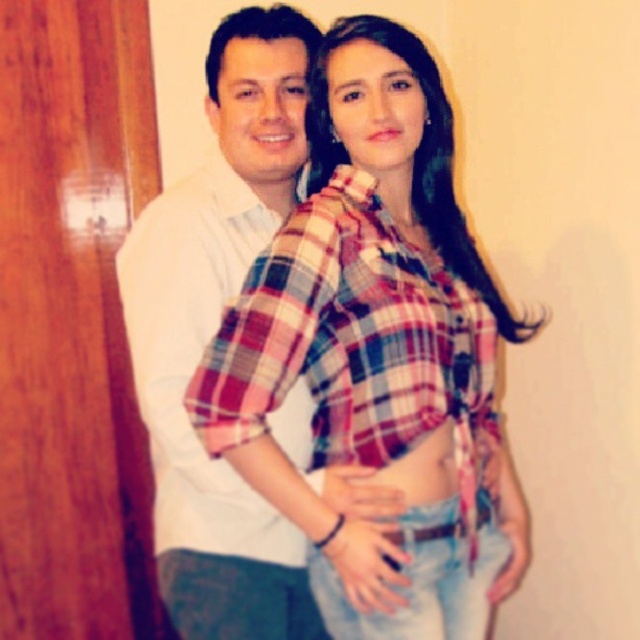
You are a photographer setting up for a portrait. You need to ensure that the plaid cotton shirt at center and smooth fabric belly at center are both visible in the frame. Based on their positions, which object should be placed higher in the composition?

The plaid cotton shirt at center is located above the smooth fabric belly at center, so to ensure both are visible, the plaid cotton shirt at center should be placed higher in the composition.